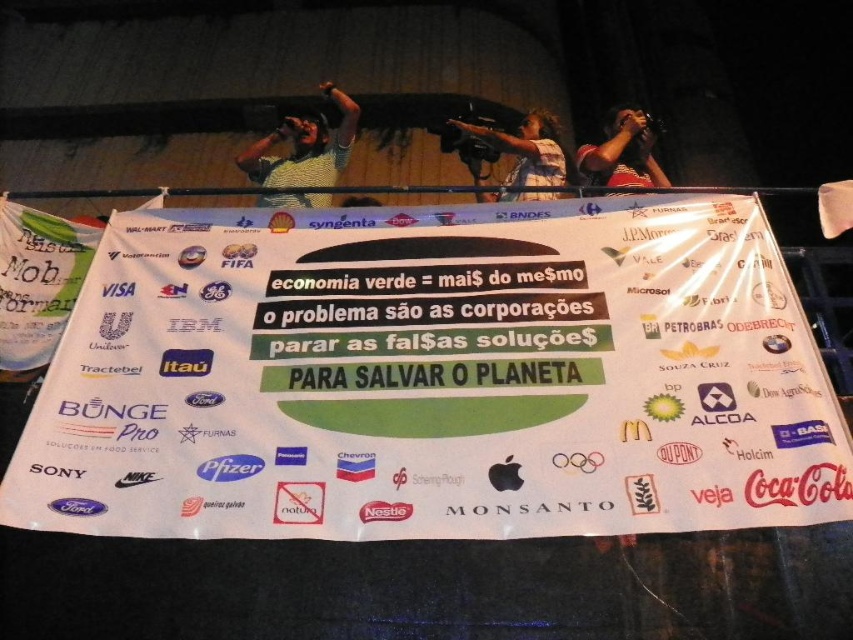
Can you confirm if yellow-green knit sweater at upper center is positioned to the right of blue denim shirt at upper center?

Incorrect, yellow-green knit sweater at upper center is not on the right side of blue denim shirt at upper center.

Which is in front, point (340, 99) or point (526, 140)?

Point (526, 140)

Locate an element on the screen. The height and width of the screenshot is (640, 853). yellow-green knit sweater at upper center is located at coordinates (305, 147).

Between white paper banner at center and yellow-green knit sweater at upper center, which one has less height?

yellow-green knit sweater at upper center

Is white paper banner at center above yellow-green knit sweater at upper center?

Actually, white paper banner at center is below yellow-green knit sweater at upper center.

Is point (598, 490) positioned before point (351, 141)?

Yes, point (598, 490) is in front of point (351, 141).

The height and width of the screenshot is (640, 853). What are the coordinates of `white paper banner at center` in the screenshot? It's located at (434, 378).

Who is taller, white paper banner at center or blue denim shirt at upper center?

Standing taller between the two is white paper banner at center.

Can you confirm if white paper banner at center is thinner than blue denim shirt at upper center?

In fact, white paper banner at center might be wider than blue denim shirt at upper center.

Does point (631, 326) come in front of point (553, 193)?

Yes.

Locate an element on the screen. The width and height of the screenshot is (853, 640). white paper banner at center is located at coordinates (x=434, y=378).